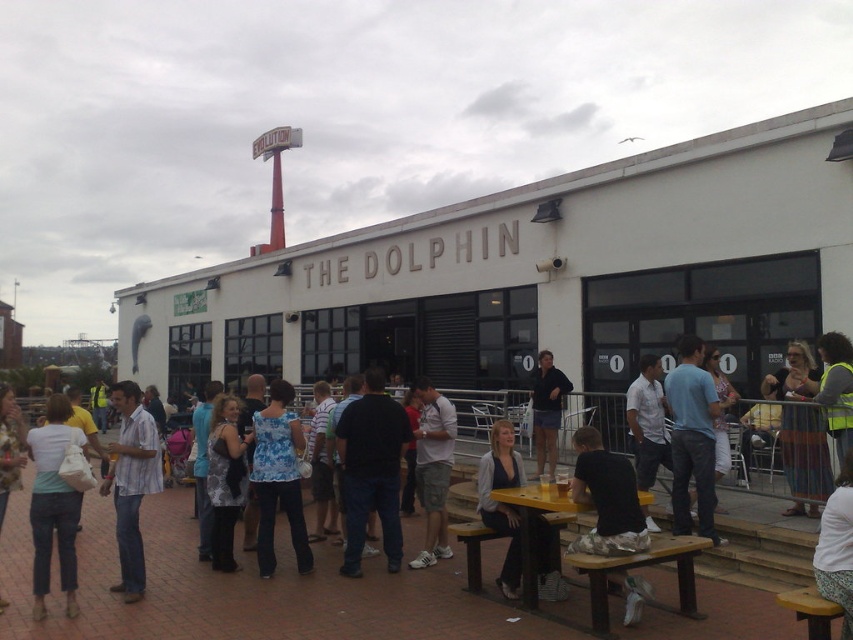
Consider the image. You are standing at the entrance of The Dolphin and see the light blue denim shorts at center. Where exactly are the light blue denim shorts located in terms of coordinates?

The light blue denim shorts at center are located at coordinates point (433, 468).

You are a photographer positioned at the entrance of The Dolphin venue. You need to capture a photo that includes both the dark blue jeans at center and the white fabric skirt at lower right. Based on their positions, which object should you adjust your camera angle to focus on first to ensure both are in frame?

Since the dark blue jeans at center is to the left of the white fabric skirt at lower right, you should first focus on the dark blue jeans at center to ensure both are included in the frame.

You are a photographer standing at the entrance of The Dolphin venue. You want to take a photo that includes both the dark blue jeans at center and the white fabric skirt at lower right. What is the minimum distance you need to move backward to ensure both subjects are in frame?

The dark blue jeans at center and white fabric skirt at lower right are 3.63 meters apart. To include both in the frame, you need to move back at least 3.63 meters to ensure the camera can capture the full distance between them.